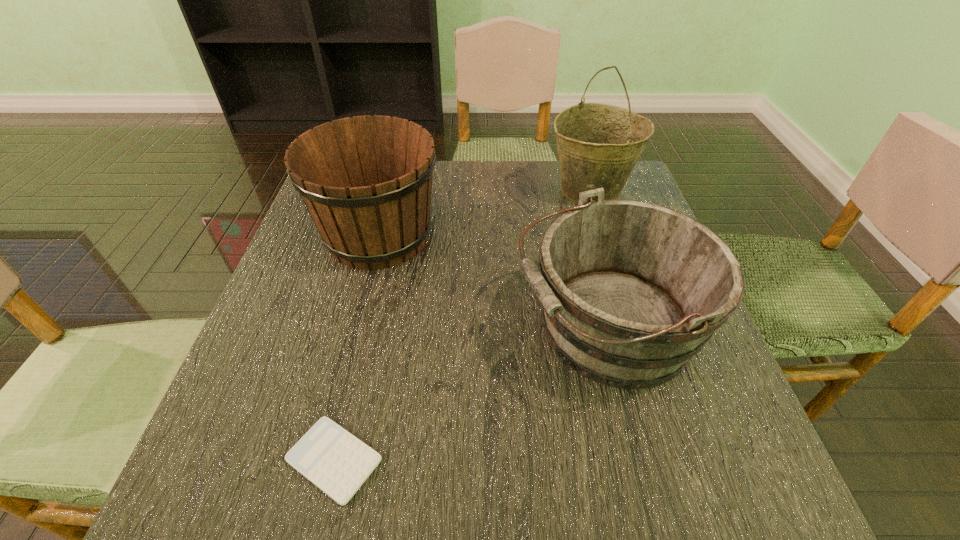
What are the coordinates of `vacant area between the leftmost wine bucket and the calculator` in the screenshot? It's located at (356, 348).

You are a GUI agent. You are given a task and a screenshot of the screen. Output one action in this format:
    pyautogui.click(x=<x>, y=<y>)
    Task: Click on the free space that is in between the tallest wine bucket and the calculator
    Image resolution: width=960 pixels, height=540 pixels.
    Given the screenshot: What is the action you would take?
    pyautogui.click(x=462, y=325)

Image resolution: width=960 pixels, height=540 pixels. Find the location of `vacant region between the shortest object and the leftmost wine bucket`. vacant region between the shortest object and the leftmost wine bucket is located at coordinates (356, 348).

Locate an element on the screen. The image size is (960, 540). the second closest object to the tallest object is located at coordinates (366, 181).

Locate an element on the screen. This screenshot has width=960, height=540. object that stands as the closest to the leftmost wine bucket is located at coordinates (631, 291).

Point out which wine bucket is positioned as the nearest to the leftmost wine bucket. Please provide its 2D coordinates. Your answer should be formatted as a tuple, i.e. [(x, y)], where the tuple contains the x and y coordinates of a point satisfying the conditions above.

[(631, 291)]

The width and height of the screenshot is (960, 540). Find the location of `wine bucket that stands as the second closest to the tallest object`. wine bucket that stands as the second closest to the tallest object is located at coordinates (366, 181).

You are a GUI agent. You are given a task and a screenshot of the screen. Output one action in this format:
    pyautogui.click(x=<x>, y=<y>)
    Task: Click on the free space that satisfies the following two spatial constraints: 1. on the back side of the tallest wine bucket; 2. on the right side of the shortest object
    The width and height of the screenshot is (960, 540).
    Given the screenshot: What is the action you would take?
    pyautogui.click(x=397, y=191)

Identify the location of blank area in the image that satisfies the following two spatial constraints: 1. on the front side of the nearest object; 2. on the right side of the leftmost wine bucket. The image size is (960, 540). (322, 460).

In order to click on free location that satisfies the following two spatial constraints: 1. on the back side of the calculator; 2. on the left side of the tallest object in this screenshot , I will do click(397, 191).